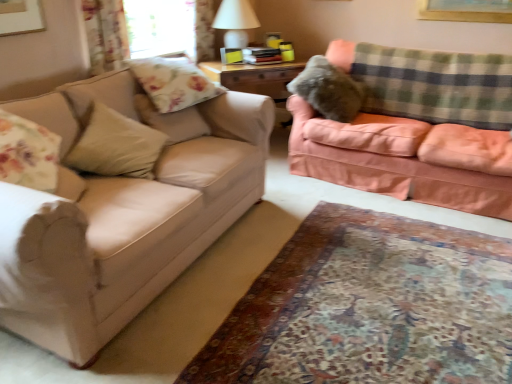
Question: Is white matte table lamp at upper center closer to camera compared to transparent glass window screen at upper center?

Choices:
 (A) yes
 (B) no

Answer: (B)

Question: Is white matte table lamp at upper center wider than transparent glass window screen at upper center?

Choices:
 (A) no
 (B) yes

Answer: (B)

Question: Is white matte table lamp at upper center located outside transparent glass window screen at upper center?

Choices:
 (A) yes
 (B) no

Answer: (A)

Question: From the image's perspective, is white matte table lamp at upper center located beneath transparent glass window screen at upper center?

Choices:
 (A) yes
 (B) no

Answer: (B)

Question: Considering the relative sizes of white matte table lamp at upper center and transparent glass window screen at upper center in the image provided, is white matte table lamp at upper center bigger than transparent glass window screen at upper center?

Choices:
 (A) no
 (B) yes

Answer: (B)

Question: From the image's perspective, is white matte table lamp at upper center above transparent glass window screen at upper center?

Choices:
 (A) no
 (B) yes

Answer: (B)

Question: Would you say floral fabric curtain at upper left is part of matte beige couch at left, the 1th studio couch viewed from the left,'s contents?

Choices:
 (A) no
 (B) yes

Answer: (A)

Question: From a real-world perspective, is matte beige couch at left, the 2th studio couch viewed from the right, positioned over floral fabric curtain at upper left based on gravity?

Choices:
 (A) yes
 (B) no

Answer: (B)

Question: Considering the relative positions of matte beige couch at left, the 1th studio couch viewed from the left, and floral fabric curtain at upper left in the image provided, is matte beige couch at left, the 1th studio couch viewed from the left, to the right of floral fabric curtain at upper left from the viewer's perspective?

Choices:
 (A) no
 (B) yes

Answer: (B)

Question: Is matte beige couch at left, the 2th studio couch viewed from the right, further to camera compared to floral fabric curtain at upper left?

Choices:
 (A) no
 (B) yes

Answer: (A)

Question: Is matte beige couch at left, the 2th studio couch viewed from the right, not inside floral fabric curtain at upper left?

Choices:
 (A) no
 (B) yes

Answer: (B)

Question: From the image's perspective, is matte beige couch at left, the 2th studio couch viewed from the right, beneath floral fabric curtain at upper left?

Choices:
 (A) no
 (B) yes

Answer: (B)

Question: Is white matte table lamp at upper center not near carpet at lower center?

Choices:
 (A) no
 (B) yes

Answer: (B)